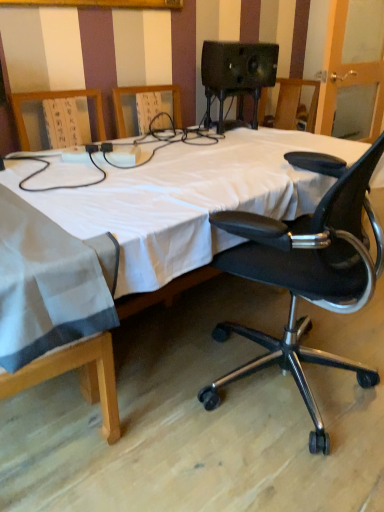
Question: Is black matte office chair at right further to the viewer compared to white fabric bed at center?

Choices:
 (A) no
 (B) yes

Answer: (B)

Question: Is black matte office chair at right smaller than white fabric bed at center?

Choices:
 (A) no
 (B) yes

Answer: (B)

Question: Considering the relative sizes of black matte office chair at right and white fabric bed at center in the image provided, is black matte office chair at right wider than white fabric bed at center?

Choices:
 (A) no
 (B) yes

Answer: (A)

Question: Are black matte office chair at right and white fabric bed at center located far from each other?

Choices:
 (A) no
 (B) yes

Answer: (A)

Question: Can you confirm if black matte office chair at right is taller than white fabric bed at center?

Choices:
 (A) yes
 (B) no

Answer: (A)

Question: From a real-world perspective, is black matte office chair at right located beneath white fabric bed at center?

Choices:
 (A) yes
 (B) no

Answer: (B)

Question: Is black matte office chair at right at the back of white fabric bed at center?

Choices:
 (A) yes
 (B) no

Answer: (A)

Question: Is white fabric bed at center to the left of black matte office chair at right from the viewer's perspective?

Choices:
 (A) no
 (B) yes

Answer: (B)

Question: From a real-world perspective, is white fabric bed at center located beneath black matte office chair at right?

Choices:
 (A) no
 (B) yes

Answer: (B)

Question: Is white fabric bed at center positioned before black matte office chair at right?

Choices:
 (A) yes
 (B) no

Answer: (A)

Question: Is white fabric bed at center positioned beyond the bounds of black matte office chair at right?

Choices:
 (A) yes
 (B) no

Answer: (A)

Question: Considering the relative sizes of white fabric bed at center and black matte office chair at right in the image provided, is white fabric bed at center thinner than black matte office chair at right?

Choices:
 (A) yes
 (B) no

Answer: (B)

Question: Considering the positions of point (359, 181) and point (324, 238), is point (359, 181) closer or farther from the camera than point (324, 238)?

Choices:
 (A) closer
 (B) farther

Answer: (A)